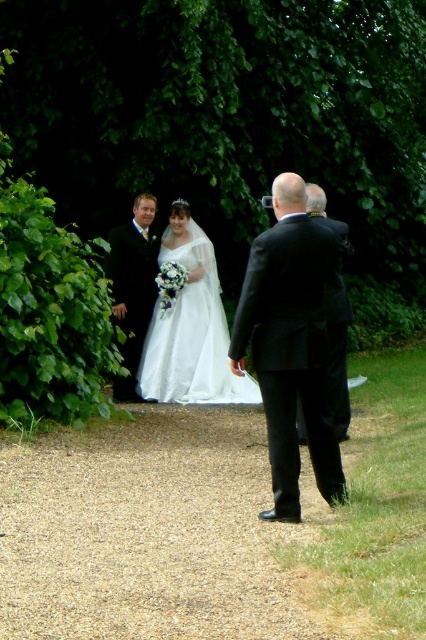
Can you confirm if white satin dress at center is positioned above white lace dress at center?

No, white satin dress at center is not above white lace dress at center.

What do you see at coordinates (290, 346) in the screenshot? I see `white satin dress at center` at bounding box center [290, 346].

Which is in front, point (253, 305) or point (224, 326)?

Point (253, 305)

Where is `white satin dress at center`? white satin dress at center is located at coordinates tap(290, 346).

Can you confirm if gravel path at center is wider than white satin dress at center?

Correct, the width of gravel path at center exceeds that of white satin dress at center.

Does point (29, 461) come closer to viewer compared to point (290, 436)?

That is False.

The height and width of the screenshot is (640, 426). What are the coordinates of `gravel path at center` in the screenshot? It's located at (149, 531).

Which is more to the right, gravel path at center or black satin suit at right?

black satin suit at right

What do you see at coordinates (149, 531) in the screenshot? Image resolution: width=426 pixels, height=640 pixels. I see `gravel path at center` at bounding box center [149, 531].

Is point (261, 496) behind point (331, 314)?

No, (261, 496) is closer to viewer.

The image size is (426, 640). What are the coordinates of `gravel path at center` in the screenshot? It's located at (149, 531).